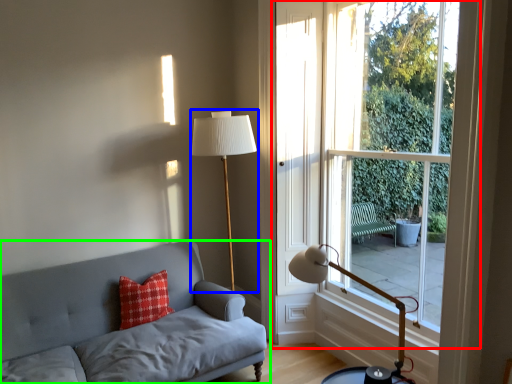
Question: Estimate the real-world distances between objects in this image. Which object is farther from window (highlighted by a red box), table lamp (highlighted by a blue box) or studio couch (highlighted by a green box)?

Choices:
 (A) table lamp
 (B) studio couch

Answer: (B)